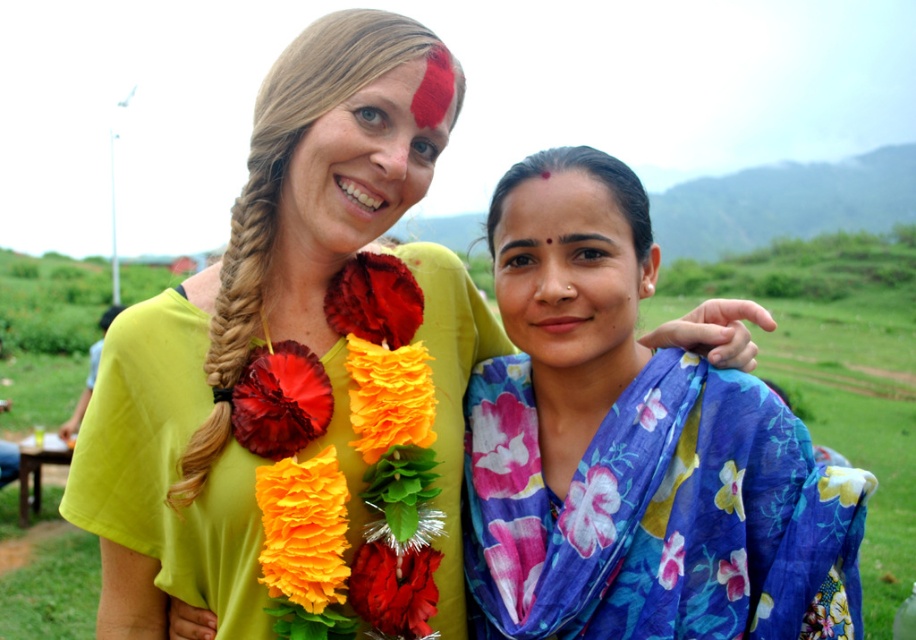
Question: Is floral scarf at center positioned behind matte yellow shirt at upper center?

Choices:
 (A) no
 (B) yes

Answer: (B)

Question: Which object is farther from the camera taking this photo?

Choices:
 (A) floral fabric scarf at upper center
 (B) floral fabric scarf at center

Answer: (B)

Question: Can you confirm if floral scarf at center is bigger than floral fabric scarf at upper center?

Choices:
 (A) yes
 (B) no

Answer: (B)

Question: Is floral fabric scarf at upper center positioned before floral fabric scarf at center?

Choices:
 (A) no
 (B) yes

Answer: (B)

Question: Which object is farther from the camera taking this photo?

Choices:
 (A) floral fabric scarf at center
 (B) floral fabric scarf at upper center

Answer: (A)

Question: Which is nearer to the floral fabric scarf at upper center?

Choices:
 (A) floral scarf at center
 (B) floral fabric scarf at center
 (C) matte yellow shirt at upper center

Answer: (C)